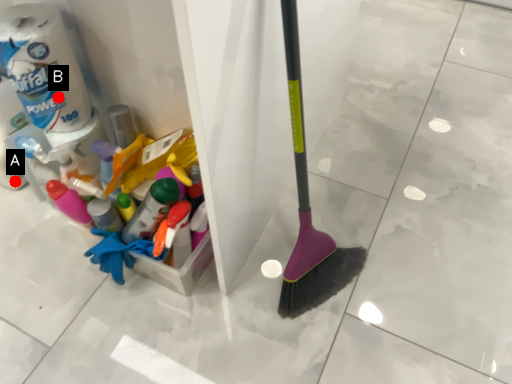
Question: Two points are circled on the image, labeled by A and B beside each circle. Among these points, which one is nearest to the camera?

Choices:
 (A) A is closer
 (B) B is closer

Answer: (B)